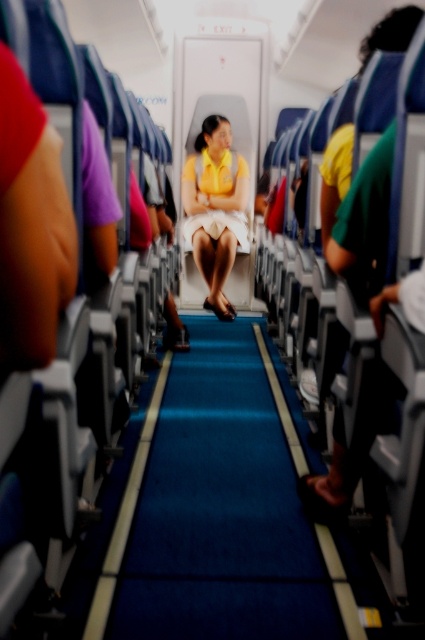
Question: Is blue carpet at center to the left of yellow matte dress at center from the viewer's perspective?

Choices:
 (A) no
 (B) yes

Answer: (B)

Question: Which of the following is the farthest from the observer?

Choices:
 (A) (232, 241)
 (B) (240, 481)

Answer: (A)

Question: Where is blue carpet at center located in relation to yellow matte dress at center in the image?

Choices:
 (A) right
 (B) left

Answer: (B)

Question: In this image, where is blue carpet at center located relative to yellow matte dress at center?

Choices:
 (A) left
 (B) right

Answer: (A)

Question: Among these points, which one is farthest from the camera?

Choices:
 (A) (198, 209)
 (B) (280, 493)

Answer: (A)